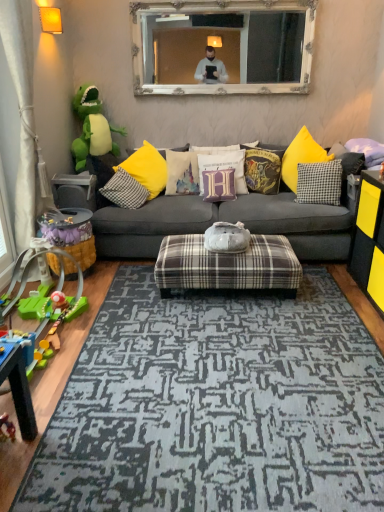
Question: Does black matte dresser at right have a lesser width compared to plaid fabric ottoman at center, which is the 1th table in bottom-to-top order?

Choices:
 (A) yes
 (B) no

Answer: (A)

Question: Could you tell me if black matte dresser at right is facing plaid fabric ottoman at center, which is the 1th table in bottom-to-top order?

Choices:
 (A) yes
 (B) no

Answer: (A)

Question: Considering the relative sizes of black matte dresser at right and plaid fabric ottoman at center, which is the 1th table in bottom-to-top order, in the image provided, is black matte dresser at right smaller than plaid fabric ottoman at center, which is the 1th table in bottom-to-top order,?

Choices:
 (A) yes
 (B) no

Answer: (A)

Question: From a real-world perspective, is black matte dresser at right physically above plaid fabric ottoman at center, which is the 1th table in bottom-to-top order?

Choices:
 (A) yes
 (B) no

Answer: (A)

Question: Are black matte dresser at right and plaid fabric ottoman at center, marked as the 2th table in a top-to-bottom arrangement, making contact?

Choices:
 (A) no
 (B) yes

Answer: (A)

Question: From a real-world perspective, is green plush dinosaur at left, marked as the 4th toy in a bottom-to-top arrangement, physically located above or below white cotton cushion at center, marked as the 2th pillow in a left-to-right arrangement?

Choices:
 (A) above
 (B) below

Answer: (A)

Question: From the image's perspective, relative to white cotton cushion at center, marked as the 2th pillow in a left-to-right arrangement, is green plush dinosaur at left, marked as the 4th toy in a bottom-to-top arrangement, above or below?

Choices:
 (A) below
 (B) above

Answer: (B)

Question: Would you say green plush dinosaur at left, marked as the 4th toy in a bottom-to-top arrangement, is inside or outside white cotton cushion at center, marked as the 2th pillow in a left-to-right arrangement?

Choices:
 (A) outside
 (B) inside

Answer: (A)

Question: Looking at the image, does green plush dinosaur at left, marked as the 4th toy in a bottom-to-top arrangement, seem bigger or smaller compared to white cotton cushion at center, the 6th pillow from the right?

Choices:
 (A) big
 (B) small

Answer: (A)

Question: Based on their sizes in the image, would you say black checkered pillow at center, which is counted as the 2th pillow, starting from the right, is bigger or smaller than purple velvet pillow at center, the 5th pillow in the right-to-left sequence?

Choices:
 (A) small
 (B) big

Answer: (B)

Question: From the image's perspective, is black checkered pillow at center, the 6th pillow in the left-to-right sequence, positioned above or below purple velvet pillow at center, the 5th pillow in the right-to-left sequence?

Choices:
 (A) above
 (B) below

Answer: (B)

Question: From their relative heights in the image, would you say black checkered pillow at center, the 6th pillow in the left-to-right sequence, is taller or shorter than purple velvet pillow at center, which is counted as the third pillow, starting from the left?

Choices:
 (A) tall
 (B) short

Answer: (A)

Question: Is black checkered pillow at center, which is counted as the 2th pillow, starting from the right, in front of or behind purple velvet pillow at center, the 5th pillow in the right-to-left sequence, in the image?

Choices:
 (A) behind
 (B) front

Answer: (B)

Question: From the image's perspective, is white ornate mirror at upper center located above or below purple fabric pillow at center, which ranks as the 4th pillow in right-to-left order?

Choices:
 (A) below
 (B) above

Answer: (B)

Question: Relative to purple fabric pillow at center, which ranks as the 4th pillow in right-to-left order, is white ornate mirror at upper center in front or behind?

Choices:
 (A) front
 (B) behind

Answer: (B)